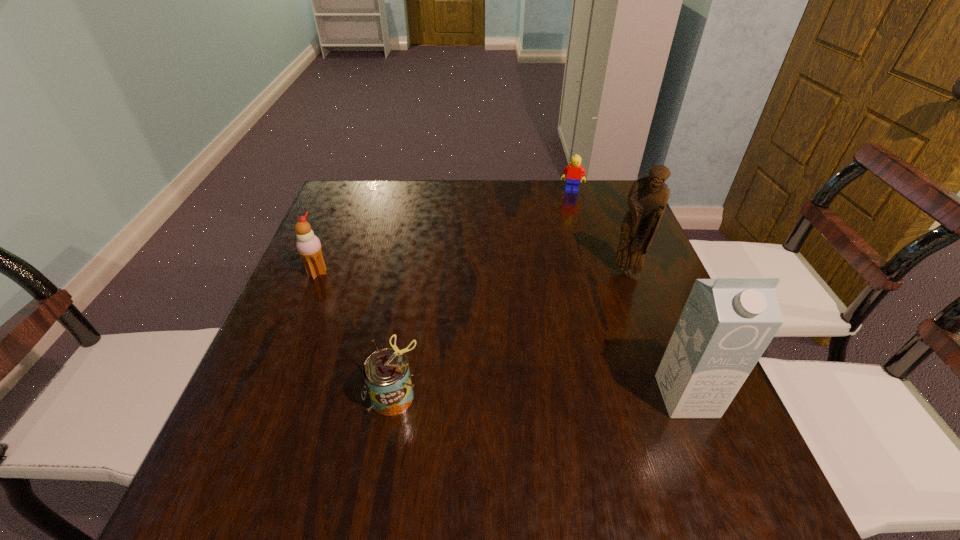
Find the location of a particular element. unoccupied position between the figurine and the fourth tallest object is located at coordinates (511, 334).

You are a GUI agent. You are given a task and a screenshot of the screen. Output one action in this format:
    pyautogui.click(x=<x>, y=<y>)
    Task: Click on the vacant area that lies between the third object from left to right and the figurine
    
    Given the screenshot: What is the action you would take?
    pyautogui.click(x=600, y=232)

Choose which object is the nearest neighbor to the figurine. Please provide its 2D coordinates. Your answer should be formatted as a tuple, i.e. [(x, y)], where the tuple contains the x and y coordinates of a point satisfying the conditions above.

[(727, 323)]

This screenshot has height=540, width=960. I want to click on object that is the fourth closest one to the icecream, so click(x=727, y=323).

At what (x,y) coordinates should I click in order to perform the action: click on free region that satisfies the following two spatial constraints: 1. on the front side of the second shortest object; 2. on the left side of the leftmost object. Please return your answer as a coordinate pair (x, y). The width and height of the screenshot is (960, 540). Looking at the image, I should click on (268, 395).